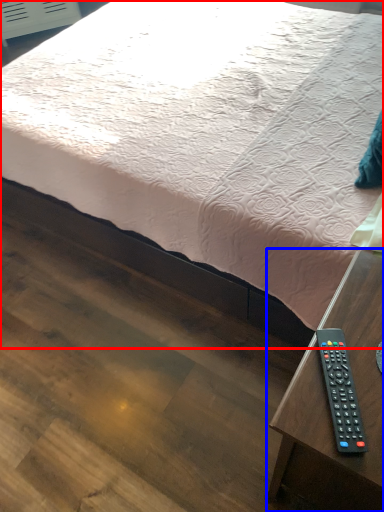
Question: Among these objects, which one is nearest to the camera, bed (highlighted by a red box) or table (highlighted by a blue box)?

Choices:
 (A) bed
 (B) table

Answer: (B)